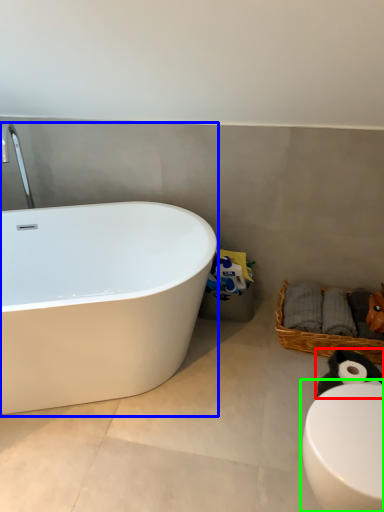
Question: Which object is positioned farthest from animal (highlighted by a red box)? Select from bathtub (highlighted by a blue box) and toilet (highlighted by a green box).

Choices:
 (A) bathtub
 (B) toilet

Answer: (A)